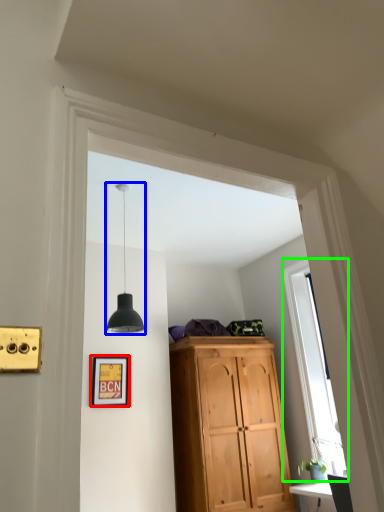
Question: Considering the real-world distances, which object is farthest from picture frame (highlighted by a red box)? light fixture (highlighted by a blue box) or window (highlighted by a green box)?

Choices:
 (A) light fixture
 (B) window

Answer: (B)